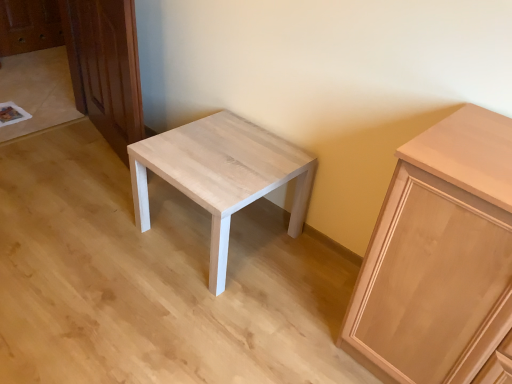
Where is `vacant space to the left of light wood/texture stool at center`? The image size is (512, 384). vacant space to the left of light wood/texture stool at center is located at coordinates (101, 257).